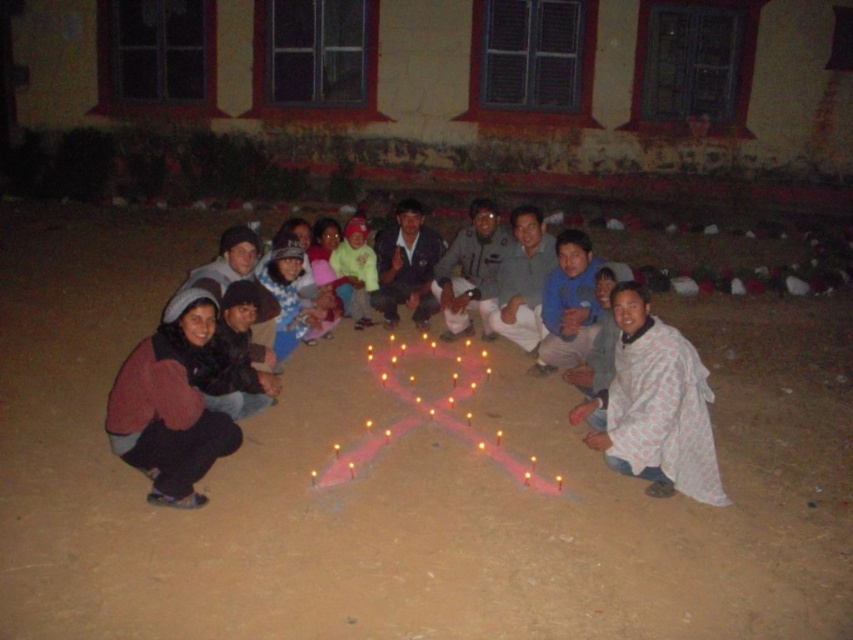
Question: Is the position of white printed cloth at lower right less distant than that of light yellow fabric at center?

Choices:
 (A) no
 (B) yes

Answer: (B)

Question: Is white printed cloth at lower right to the left of light yellow fabric at center from the viewer's perspective?

Choices:
 (A) no
 (B) yes

Answer: (A)

Question: Which point is closer to the camera?

Choices:
 (A) (367, 312)
 (B) (624, 339)

Answer: (B)

Question: Which point is closer to the camera?

Choices:
 (A) light yellow fabric at center
 (B) white printed cloth at lower right

Answer: (B)

Question: Can you confirm if white printed cloth at lower right is thinner than light yellow fabric at center?

Choices:
 (A) yes
 (B) no

Answer: (B)

Question: Which of the following is the closest to the observer?

Choices:
 (A) white printed cloth at lower right
 (B) light yellow fabric at center

Answer: (A)